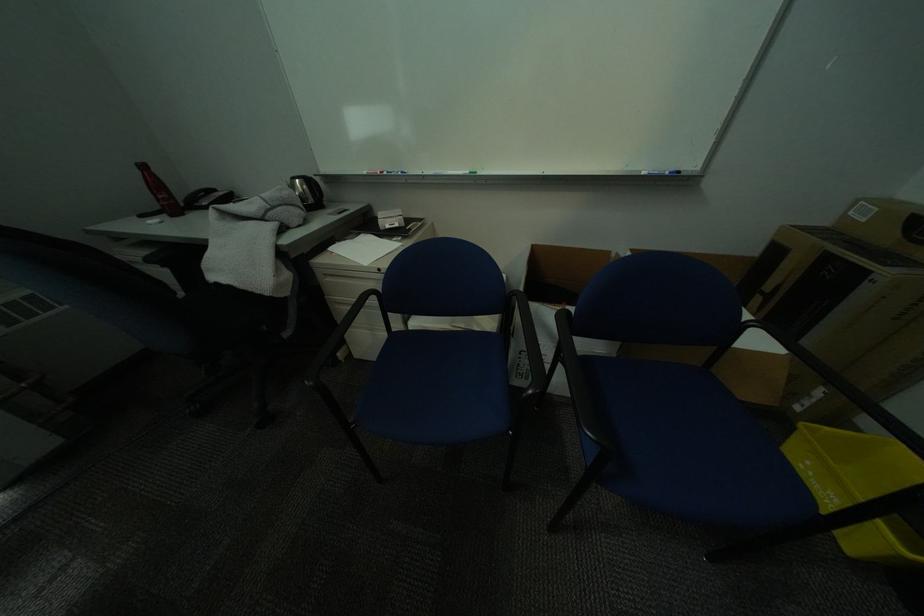
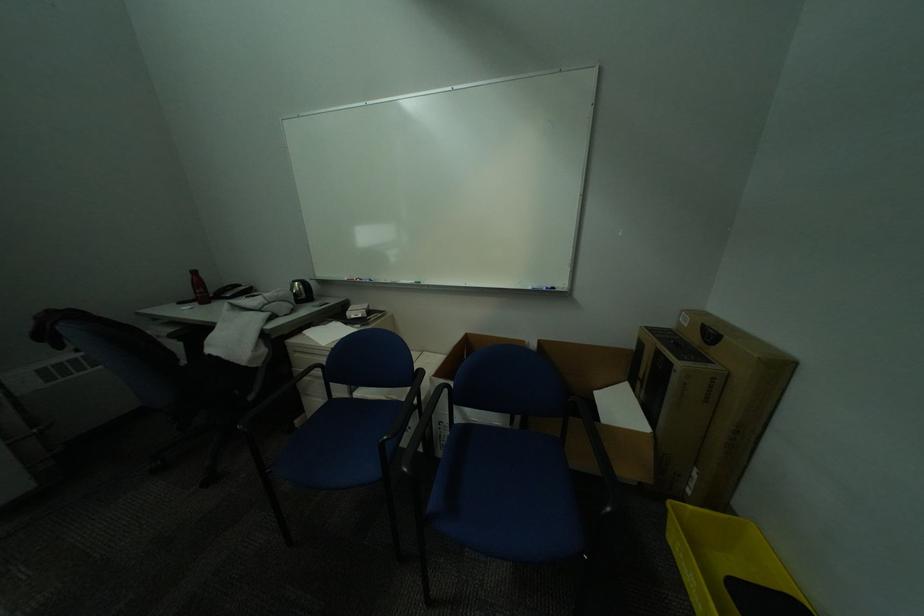
The point at (348, 355) is marked in the first image. Where is the corresponding point in the second image?

(306, 423)